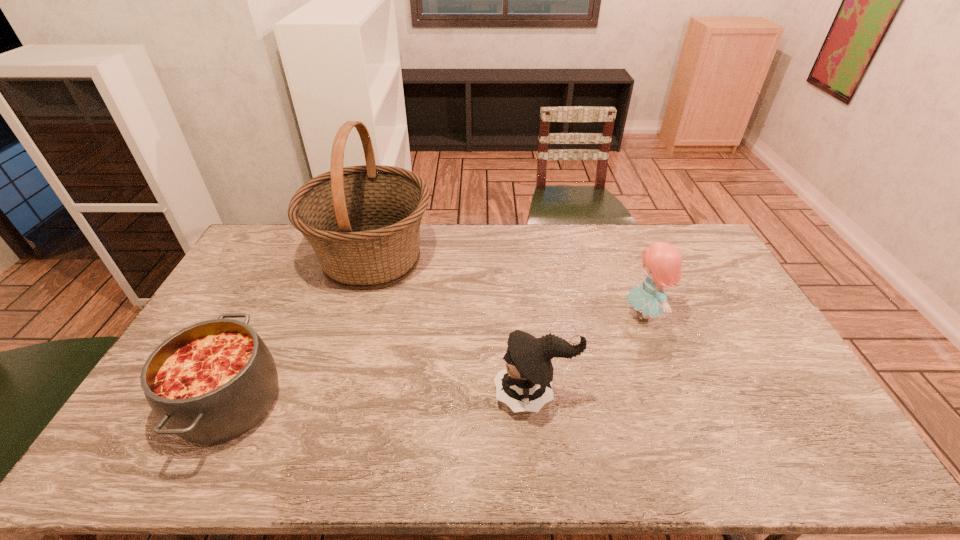
This screenshot has height=540, width=960. What are the coordinates of `vacant space at the left edge of the desktop` in the screenshot? It's located at (225, 287).

Locate an element on the screen. free space at the right edge of the desktop is located at coordinates (736, 318).

The image size is (960, 540). Find the location of `vacant area at the near right corner`. vacant area at the near right corner is located at coordinates (775, 444).

Where is `free space between the farther doll and the tallest object`? This screenshot has width=960, height=540. free space between the farther doll and the tallest object is located at coordinates (508, 287).

Image resolution: width=960 pixels, height=540 pixels. Find the location of `free space between the shortest object and the rightmost object`. free space between the shortest object and the rightmost object is located at coordinates click(x=437, y=359).

Find the location of a particular element. The image size is (960, 540). empty space between the casserole and the rightmost object is located at coordinates (437, 359).

Locate an element on the screen. Image resolution: width=960 pixels, height=540 pixels. empty space between the third object from left to right and the tallest object is located at coordinates (453, 327).

In order to click on empty location between the basket and the rightmost object in this screenshot , I will do `click(508, 287)`.

Image resolution: width=960 pixels, height=540 pixels. Find the location of `unoccupied area between the third object from left to right and the shortest object`. unoccupied area between the third object from left to right and the shortest object is located at coordinates (382, 399).

At what (x,y) coordinates should I click in order to perform the action: click on unoccupied area between the nearer doll and the casserole. Please return your answer as a coordinate pair (x, y). Looking at the image, I should click on (382, 399).